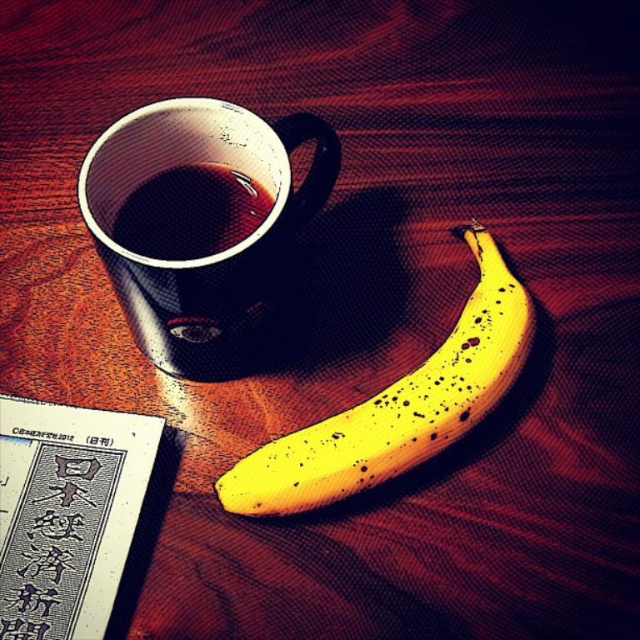
You are setting up a small table for a cozy evening. You have a matte black mug at upper left and a yellow matte banana at center. Which object is wider?

The yellow matte banana at center is wider than the matte black mug at upper left.

You are arranging items on a table and need to place the yellow matte banana at center and the shiny black cup at upper left. According to the image, which item is located to the right of the other?

The yellow matte banana at center is positioned on the right side of the shiny black cup at upper left.

You are arranging items on a shelf and need to place both the matte black mug at upper left and the shiny black cup at upper left. According to the image, which one should you place higher up so they align with their positions in the scene?

You should place the shiny black cup at upper left higher up because in the image, the matte black mug at upper left is positioned below the shiny black cup at upper left.